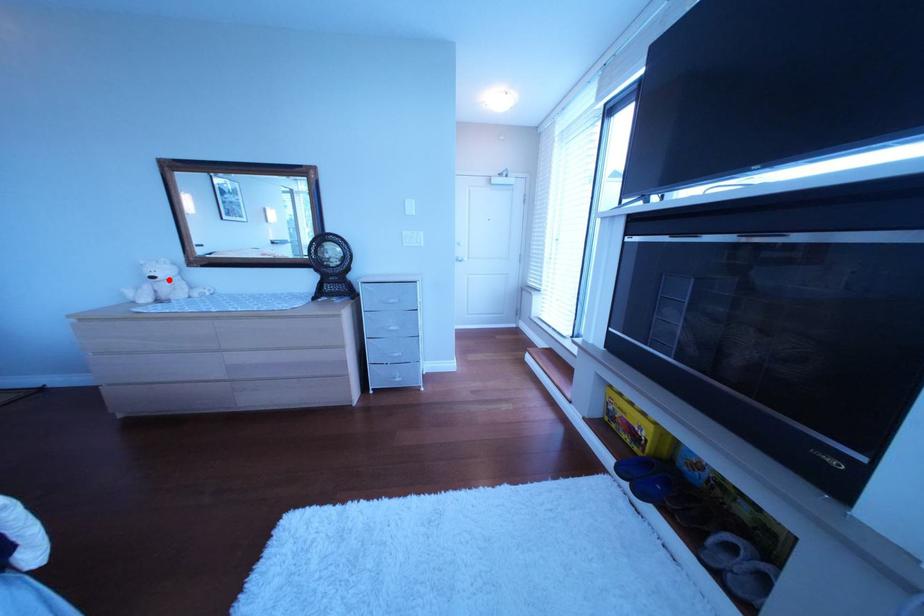
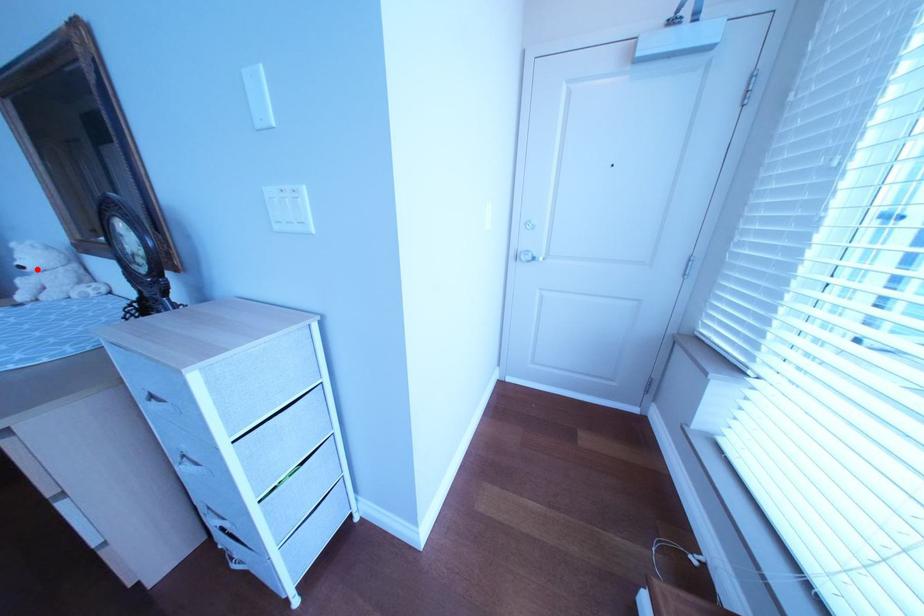
I am providing you with two images of the same scene from different viewpoints. A red point is marked on the first image and another point is marked on the second image. Does the point marked in image1 correspond to the same location as the one in image2?

Yes